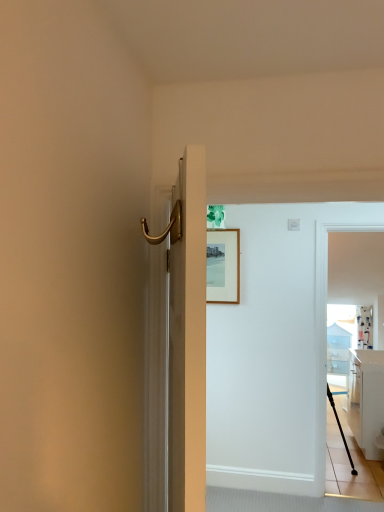
Question: Is white glossy cabinet at right to the left of white fabric curtain at upper right from the viewer's perspective?

Choices:
 (A) yes
 (B) no

Answer: (A)

Question: Are white glossy cabinet at right and white fabric curtain at upper right located far from each other?

Choices:
 (A) yes
 (B) no

Answer: (B)

Question: Can you confirm if white glossy cabinet at right is wider than white fabric curtain at upper right?

Choices:
 (A) yes
 (B) no

Answer: (A)

Question: Is white glossy cabinet at right shorter than white fabric curtain at upper right?

Choices:
 (A) yes
 (B) no

Answer: (B)

Question: From the image's perspective, would you say white glossy cabinet at right is shown under white fabric curtain at upper right?

Choices:
 (A) no
 (B) yes

Answer: (B)

Question: From the image's perspective, relative to white fabric curtain at upper right, is black matte tripod at lower right above or below?

Choices:
 (A) above
 (B) below

Answer: (B)

Question: Is black matte tripod at lower right wider or thinner than white fabric curtain at upper right?

Choices:
 (A) thin
 (B) wide

Answer: (B)

Question: Is point (339, 428) closer or farther from the camera than point (360, 331)?

Choices:
 (A) farther
 (B) closer

Answer: (B)

Question: In terms of size, does black matte tripod at lower right appear bigger or smaller than white fabric curtain at upper right?

Choices:
 (A) small
 (B) big

Answer: (B)

Question: In terms of width, does white glossy cabinet at right look wider or thinner when compared to black rubber cane at right?

Choices:
 (A) wide
 (B) thin

Answer: (B)

Question: Is white glossy cabinet at right inside the boundaries of black rubber cane at right, or outside?

Choices:
 (A) outside
 (B) inside

Answer: (A)

Question: From a real-world perspective, is white glossy cabinet at right positioned above or below black rubber cane at right?

Choices:
 (A) below
 (B) above

Answer: (B)

Question: From the image's perspective, relative to black rubber cane at right, is white glossy cabinet at right above or below?

Choices:
 (A) below
 (B) above

Answer: (B)

Question: From the image's perspective, is white fabric curtain at upper right above or below white glossy screen door at right?

Choices:
 (A) below
 (B) above

Answer: (A)

Question: Is white fabric curtain at upper right to the left or to the right of white glossy screen door at right in the image?

Choices:
 (A) right
 (B) left

Answer: (A)